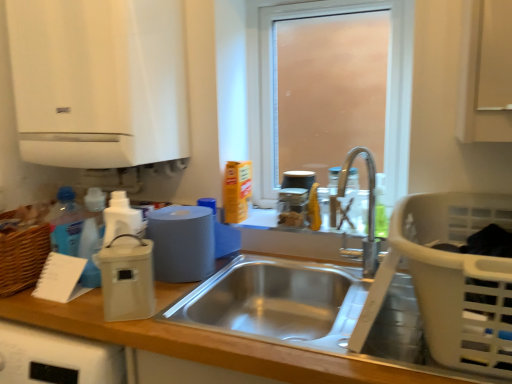
Question: Could you tell me if stainless steel sink at center is facing beige plastic container at left, the third appliance positioned from the back?

Choices:
 (A) no
 (B) yes

Answer: (A)

Question: Can you see stainless steel sink at center touching beige plastic container at left, the third appliance positioned from the back?

Choices:
 (A) no
 (B) yes

Answer: (A)

Question: Is stainless steel sink at center positioned behind beige plastic container at left, which is the 3th appliance in right-to-left order?

Choices:
 (A) yes
 (B) no

Answer: (B)

Question: Is stainless steel sink at center taller than beige plastic container at left, the third appliance positioned from the back?

Choices:
 (A) yes
 (B) no

Answer: (B)

Question: From a real-world perspective, is stainless steel sink at center beneath beige plastic container at left, which is the 1th appliance in front-to-back order?

Choices:
 (A) yes
 (B) no

Answer: (A)

Question: Is clear glass bottle at sink, positioned as the 1th bottle in left-to-right order, inside or outside of white matte vent at upper left?

Choices:
 (A) outside
 (B) inside

Answer: (A)

Question: Based on their sizes in the image, would you say clear glass bottle at sink, positioned as the 1th bottle in left-to-right order, is bigger or smaller than white matte vent at upper left?

Choices:
 (A) big
 (B) small

Answer: (B)

Question: In the image, is clear glass bottle at sink, marked as the second bottle in a right-to-left arrangement, positioned in front of or behind white matte vent at upper left?

Choices:
 (A) front
 (B) behind

Answer: (B)

Question: From the image's perspective, relative to white matte vent at upper left, is clear glass bottle at sink, positioned as the 1th bottle in left-to-right order, above or below?

Choices:
 (A) below
 (B) above

Answer: (A)

Question: From a real-world perspective, is wooden at left positioned above or below beige plastic container at left, the third appliance positioned from the back?

Choices:
 (A) above
 (B) below

Answer: (B)

Question: In terms of height, does wooden at left look taller or shorter compared to beige plastic container at left, which is the 1th appliance in front-to-back order?

Choices:
 (A) tall
 (B) short

Answer: (A)

Question: Based on their sizes in the image, would you say wooden at left is bigger or smaller than beige plastic container at left, which is the 1th appliance in front-to-back order?

Choices:
 (A) big
 (B) small

Answer: (A)

Question: In the image, is wooden at left positioned in front of or behind beige plastic container at left, which is the 1th appliance in front-to-back order?

Choices:
 (A) behind
 (B) front

Answer: (B)

Question: Is translucent plastic soap dispenser at upper right, the first bottle viewed from the right, to the left or to the right of stainless steel sink at center in the image?

Choices:
 (A) right
 (B) left

Answer: (A)

Question: From a real-world perspective, is translucent plastic soap dispenser at upper right, acting as the 2th bottle starting from the left, physically located above or below stainless steel sink at center?

Choices:
 (A) below
 (B) above

Answer: (B)